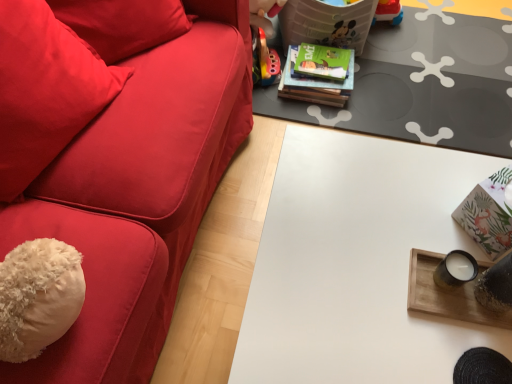
Question: In the image, is white matte table at center, the first table when ordered from front to back, on the left side or the right side of green matte book at upper center?

Choices:
 (A) left
 (B) right

Answer: (B)

Question: From a real-world perspective, relative to green matte book at upper center, is white matte table at center, the 3th table when ordered from top to bottom, vertically above or below?

Choices:
 (A) below
 (B) above

Answer: (B)

Question: Which object is positioned closest to the wooden tray at right, the second table when ordered from front to back?

Choices:
 (A) white matte table at center, the 3th table when ordered from top to bottom
 (B) velvety red throw pillow at left
 (C) matte gray table at center, the 1th table from the back
 (D) green matte book at upper center

Answer: (A)

Question: Which object is positioned farthest from the velvety red throw pillow at left?

Choices:
 (A) white matte table at center, which ranks as the 3th table in back-to-front order
 (B) matte gray table at center, the 1th table from the back
 (C) wooden tray at right, the second table when ordered from front to back
 (D) green matte book at upper center

Answer: (B)